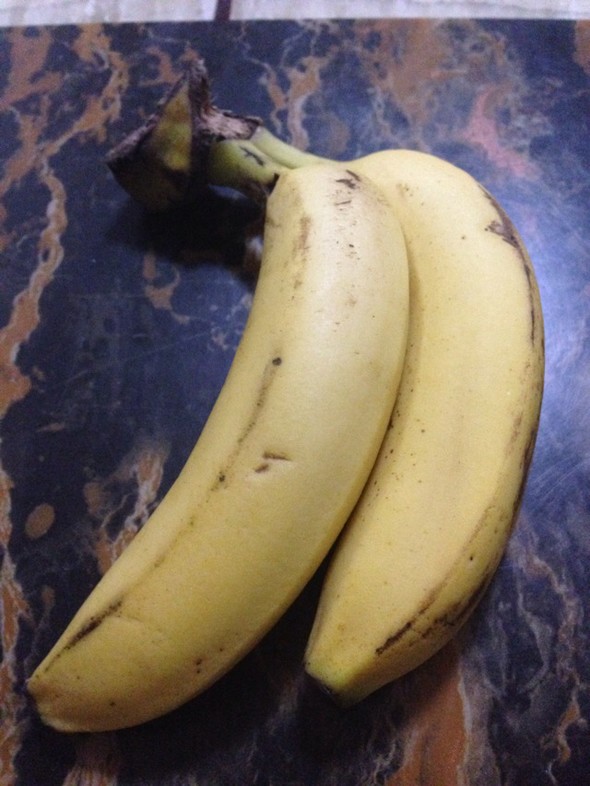
Where is `edge of marble surface and floor`? This screenshot has height=786, width=590. edge of marble surface and floor is located at coordinates (582, 23), (517, 13), (403, 20), (314, 19), (222, 19), (133, 24), (61, 24).